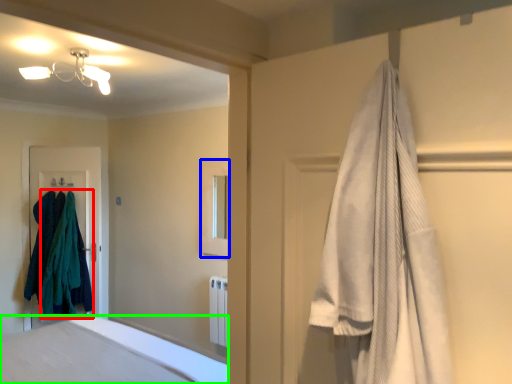
Question: Which object is positioned farthest from clothing (highlighted by a red box)? Select from medicine cabinet (highlighted by a blue box) and bathtub (highlighted by a green box).

Choices:
 (A) medicine cabinet
 (B) bathtub

Answer: (B)